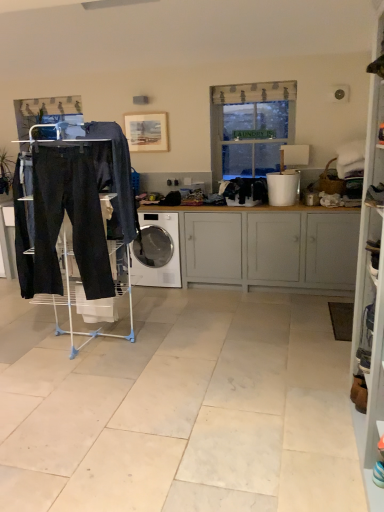
Question: Could you tell me if matte black drying rack at left is turned towards white plastic bucket at right?

Choices:
 (A) no
 (B) yes

Answer: (A)

Question: Is matte black drying rack at left behind white plastic bucket at right?

Choices:
 (A) no
 (B) yes

Answer: (A)

Question: Is matte black drying rack at left positioned with its back to white plastic bucket at right?

Choices:
 (A) yes
 (B) no

Answer: (B)

Question: From a real-world perspective, is matte black drying rack at left located higher than white plastic bucket at right?

Choices:
 (A) yes
 (B) no

Answer: (B)

Question: From a real-world perspective, is matte black drying rack at left under white plastic bucket at right?

Choices:
 (A) yes
 (B) no

Answer: (A)

Question: Does matte black drying rack at left have a greater width compared to white plastic bucket at right?

Choices:
 (A) no
 (B) yes

Answer: (B)

Question: Is white painted wood cabinet at center to the right of translucent fabric window at center from the viewer's perspective?

Choices:
 (A) no
 (B) yes

Answer: (A)

Question: From the image's perspective, is white painted wood cabinet at center on top of translucent fabric window at center?

Choices:
 (A) no
 (B) yes

Answer: (A)

Question: Can you confirm if white painted wood cabinet at center is taller than translucent fabric window at center?

Choices:
 (A) yes
 (B) no

Answer: (B)

Question: Is white painted wood cabinet at center further to camera compared to translucent fabric window at center?

Choices:
 (A) yes
 (B) no

Answer: (B)

Question: Is white painted wood cabinet at center next to translucent fabric window at center?

Choices:
 (A) no
 (B) yes

Answer: (A)

Question: Is white painted wood cabinet at center thinner than translucent fabric window at center?

Choices:
 (A) no
 (B) yes

Answer: (A)

Question: From the image's perspective, is black fabric clothes at center, which appears as the 1th clothing when viewed from the back, located above white glossy washing machine at center?

Choices:
 (A) yes
 (B) no

Answer: (A)